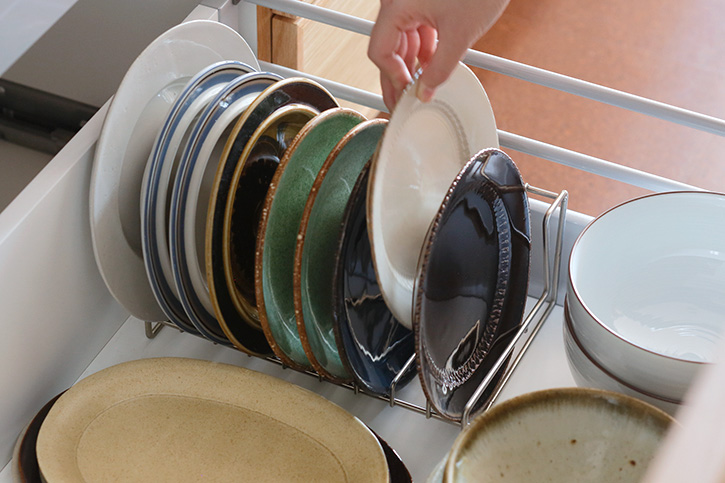
You are a GUI agent. You are given a task and a screenshot of the screen. Output one action in this format:
    pyautogui.click(x=<x>, y=<y>)
    Task: Click on the flatware
    The image size is (725, 483).
    Given the screenshot: What is the action you would take?
    pyautogui.click(x=128, y=147), pyautogui.click(x=402, y=156), pyautogui.click(x=290, y=230), pyautogui.click(x=328, y=216)